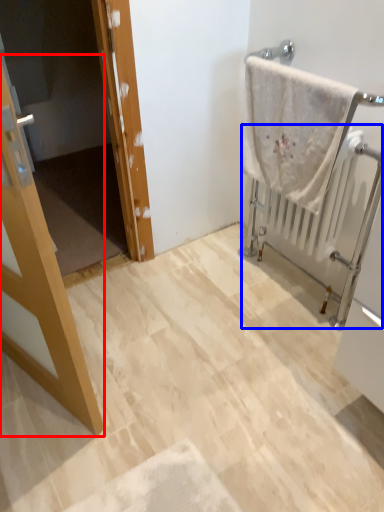
Question: Among these objects, which one is farthest to the camera, door (highlighted by a red box) or radiator (highlighted by a blue box)?

Choices:
 (A) door
 (B) radiator

Answer: (B)